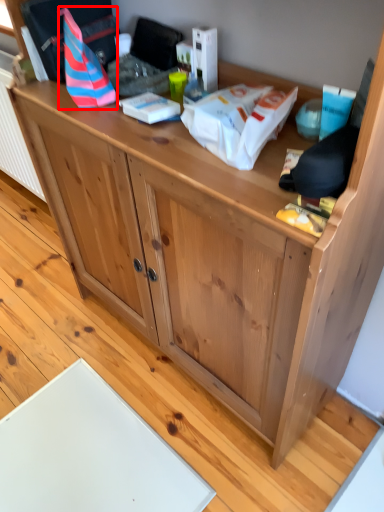
Question: From the image's perspective, what is the correct spatial positioning of kit (annotated by the red box) in reference to kit?

Choices:
 (A) above
 (B) below

Answer: (A)